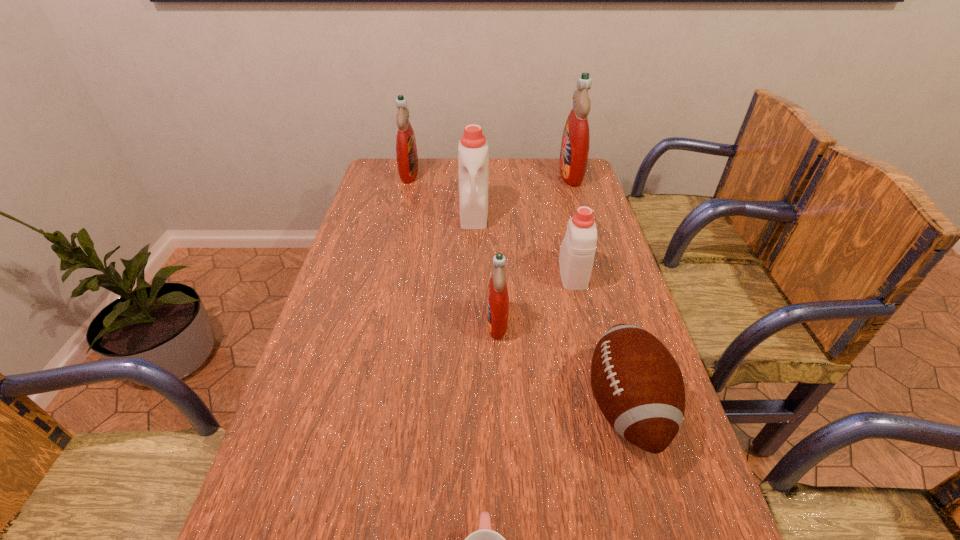
Identify the location of the tallest detergent. The width and height of the screenshot is (960, 540). (574, 152).

You are a GUI agent. You are given a task and a screenshot of the screen. Output one action in this format:
    pyautogui.click(x=<x>, y=<y>)
    Task: Click on the rightmost red detergent
    Image resolution: width=960 pixels, height=540 pixels.
    Given the screenshot: What is the action you would take?
    pyautogui.click(x=574, y=152)

Find the location of a particular element. This screenshot has width=960, height=540. the leftmost object is located at coordinates (406, 149).

The width and height of the screenshot is (960, 540). Find the location of `the second smallest red detergent`. the second smallest red detergent is located at coordinates (406, 149).

At what (x,y) coordinates should I click in order to perform the action: click on the farther white detergent. Please return your answer as a coordinate pair (x, y). This screenshot has height=540, width=960. Looking at the image, I should click on (473, 173).

At what (x,y) coordinates should I click in order to perform the action: click on the fifth nearest object. Please return your answer as a coordinate pair (x, y). This screenshot has height=540, width=960. Looking at the image, I should click on (473, 173).

Locate an element on the screen. The height and width of the screenshot is (540, 960). the smaller white detergent is located at coordinates (576, 257).

You are a GUI agent. You are given a task and a screenshot of the screen. Output one action in this format:
    pyautogui.click(x=<x>, y=<y>)
    Task: Click on the right white detergent
    This screenshot has width=960, height=540.
    Given the screenshot: What is the action you would take?
    pyautogui.click(x=576, y=257)

This screenshot has width=960, height=540. In order to click on the third nearest object in this screenshot , I will do `click(497, 305)`.

Locate an element on the screen. The height and width of the screenshot is (540, 960). the second red detergent from left to right is located at coordinates (497, 305).